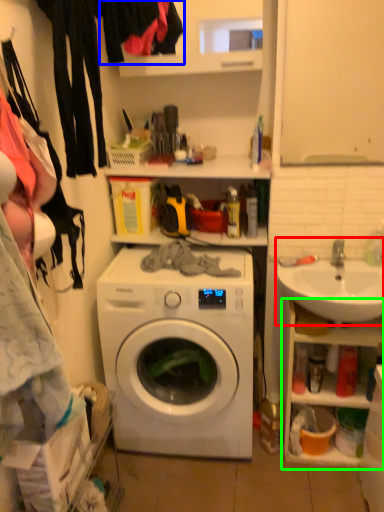
Question: Considering the real-world distances, which object is farthest from sink (highlighted by a red box)? clothing (highlighted by a blue box) or cabinet (highlighted by a green box)?

Choices:
 (A) clothing
 (B) cabinet

Answer: (A)